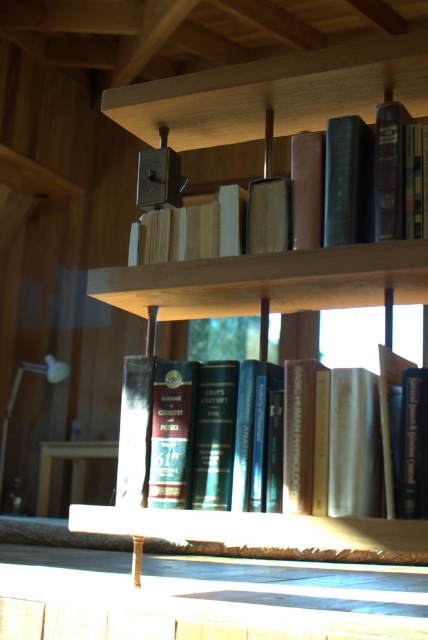
Question: Which point appears closest to the camera in this image?

Choices:
 (A) (210, 196)
 (B) (309, 84)

Answer: (B)

Question: Is hardcover books at center in front of hardcover book at upper center?

Choices:
 (A) no
 (B) yes

Answer: (B)

Question: Estimate the real-world distances between objects in this image. Which object is farther from the hardcover book at upper center?

Choices:
 (A) wooden bookcase at center
 (B) hardcover books at center

Answer: (B)

Question: Can you confirm if hardcover books at center is positioned below hardcover book at upper center?

Choices:
 (A) yes
 (B) no

Answer: (A)

Question: Which point is closer to the camera taking this photo?

Choices:
 (A) (151, 449)
 (B) (379, 273)

Answer: (B)

Question: Does wooden bookcase at center have a greater width compared to hardcover books at center?

Choices:
 (A) yes
 (B) no

Answer: (A)